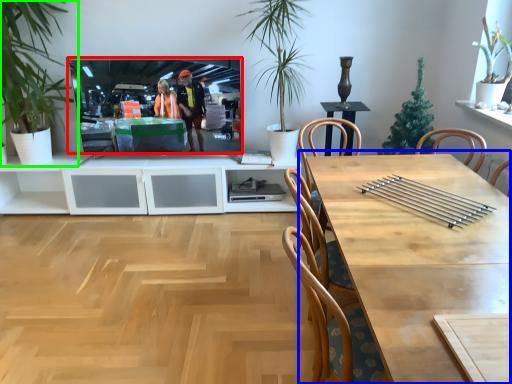
Question: Considering the real-world distances, which object is closest to television (highlighted by a red box)? table (highlighted by a blue box) or houseplant (highlighted by a green box).

Choices:
 (A) table
 (B) houseplant

Answer: (B)